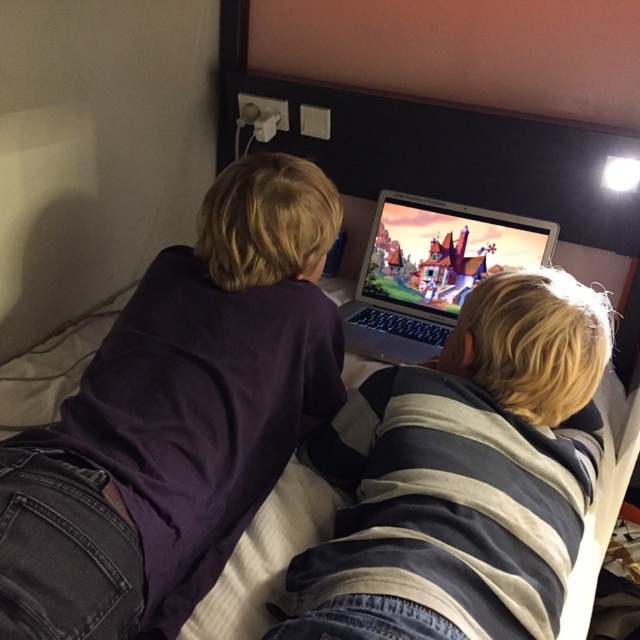
Question: Can you confirm if purple matte shirt at upper left is positioned above satin silver laptop at upper center?

Choices:
 (A) yes
 (B) no

Answer: (B)

Question: Does striped hoodie at center come behind satin silver laptop at upper center?

Choices:
 (A) yes
 (B) no

Answer: (B)

Question: Which of the following is the farthest from the observer?

Choices:
 (A) satin silver laptop at upper center
 (B) striped hoodie at center

Answer: (A)

Question: Which of the following is the closest to the observer?

Choices:
 (A) striped hoodie at center
 (B) satin silver laptop at upper center

Answer: (A)

Question: Which point appears farthest from the camera in this image?

Choices:
 (A) 385,273
 (B) 609,305

Answer: (A)

Question: Does striped hoodie at center have a smaller size compared to satin silver laptop at upper center?

Choices:
 (A) yes
 (B) no

Answer: (B)